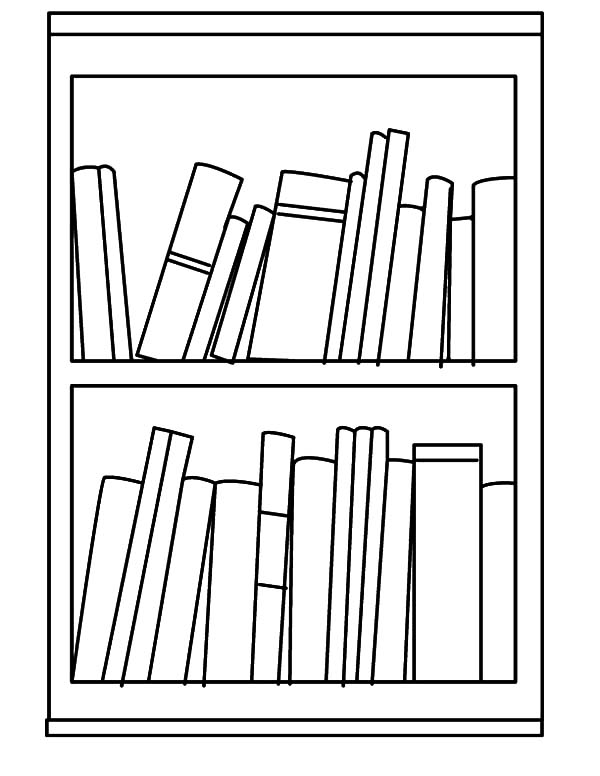
In order to click on rectangles on the book spines and rectangles on the bookcase itself in this screenshot , I will do `click(438, 18)`, `click(183, 261)`, `click(317, 213)`, `click(358, 729)`, `click(375, 704)`, `click(503, 386)`, `click(462, 74)`, `click(462, 449)`, `click(275, 546)`.